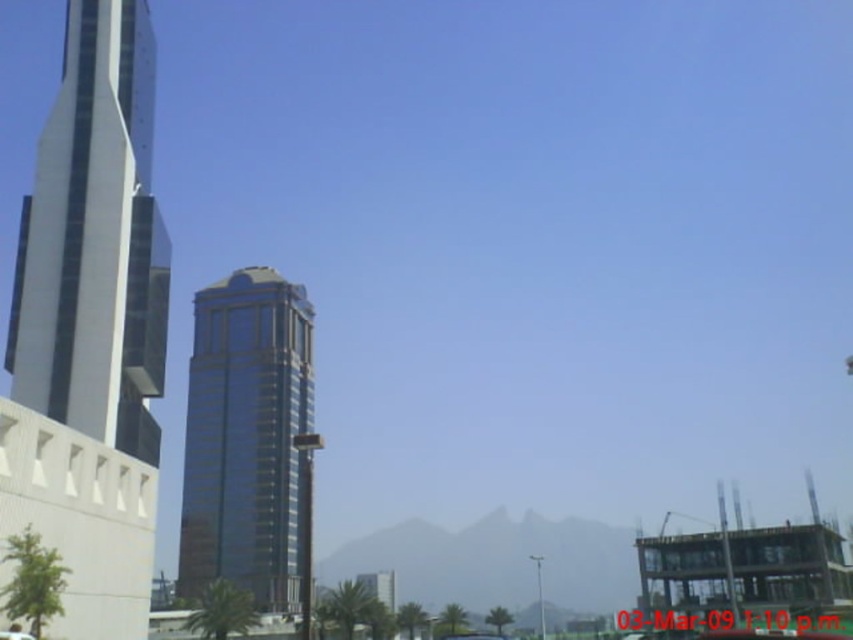
Question: Does glassy metallic skyscraper at left appear over metallic silver car at lower left?

Choices:
 (A) yes
 (B) no

Answer: (A)

Question: Observing the image, what is the correct spatial positioning of glassy metallic skyscraper at left in reference to metallic silver car at lower left?

Choices:
 (A) left
 (B) right

Answer: (A)

Question: Does glassy metallic skyscraper at left have a lesser width compared to metallic silver car at lower left?

Choices:
 (A) no
 (B) yes

Answer: (A)

Question: Among these objects, which one is farthest from the camera?

Choices:
 (A) metallic silver car at lower left
 (B) glassy metallic skyscraper at left

Answer: (B)

Question: Which of the following is the farthest from the observer?

Choices:
 (A) (9, 636)
 (B) (186, 589)

Answer: (B)

Question: Which object is positioned farthest from the metallic silver car at lower left?

Choices:
 (A) glassy metallic skyscraper at left
 (B) glossy glass tower at center

Answer: (B)